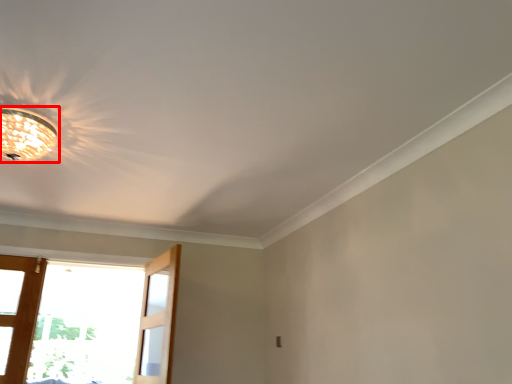
Question: From the image's perspective, what is the correct spatial positioning of lamp (annotated by the red box) in reference to screen door?

Choices:
 (A) below
 (B) above

Answer: (B)